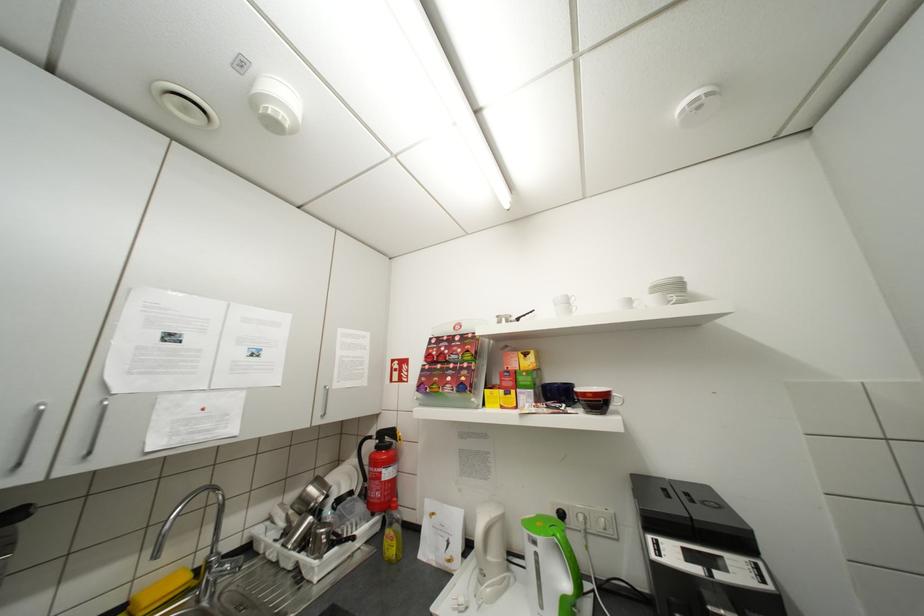
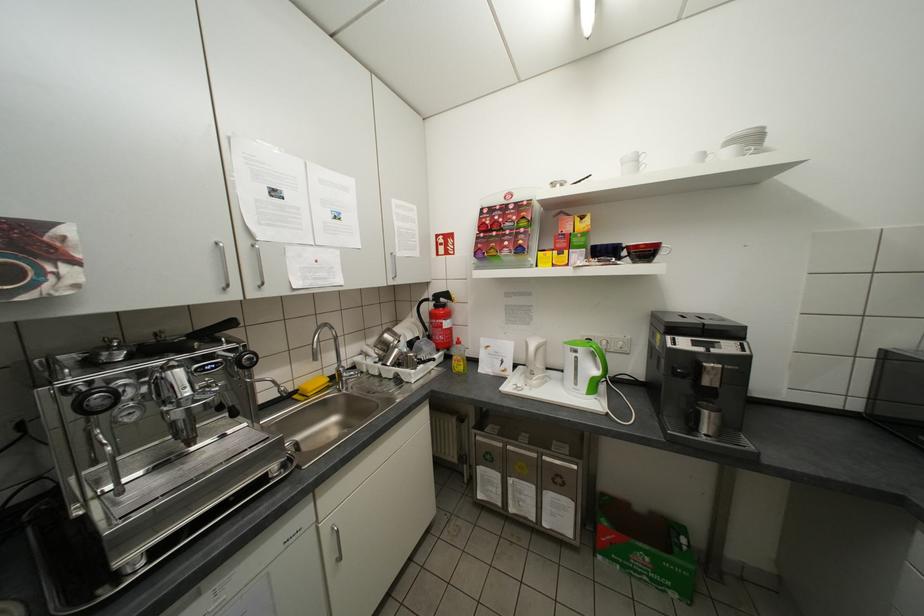
In the second image, find the point that corresponds to (x=598, y=395) in the first image.

(650, 246)